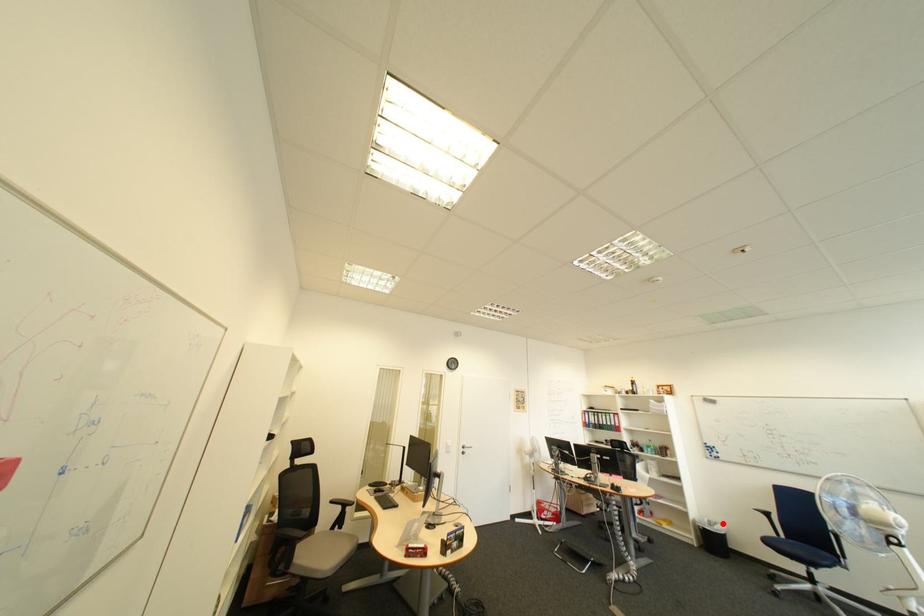
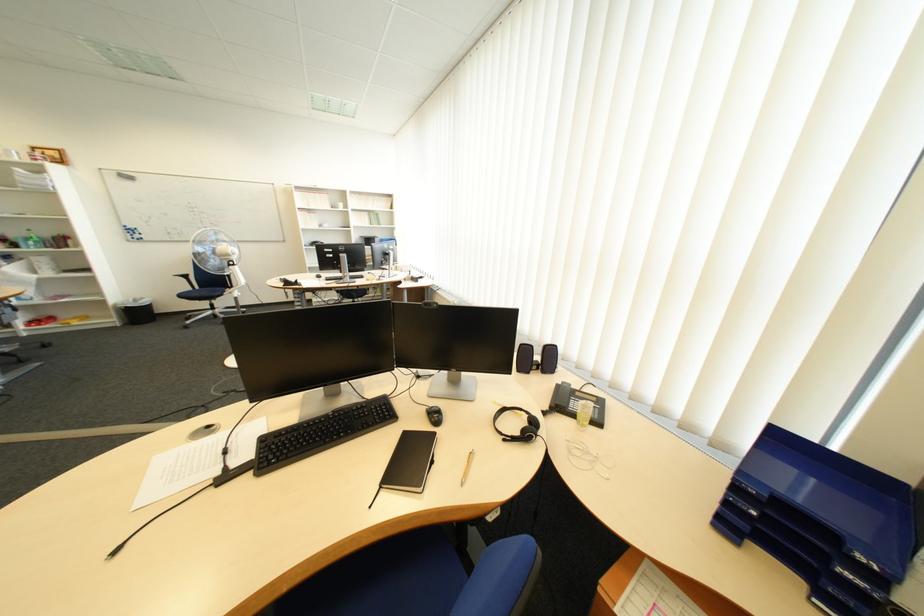
Where in the second image is the point corresponding to the highlighted location from the first image?

(149, 302)